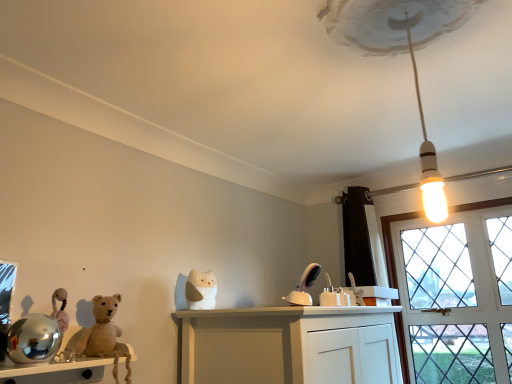
Question: Is point (419, 211) positioned closer to the camera than point (200, 281)?

Choices:
 (A) closer
 (B) farther

Answer: (B)

Question: Which is correct: clear glass window at right is inside white matte cat at center, or outside of it?

Choices:
 (A) inside
 (B) outside

Answer: (B)

Question: Estimate the real-world distances between objects in this image. Which object is closer to the white glossy bulb at upper center?

Choices:
 (A) clear glass window at right
 (B) white matte cat at center
 (C) fuzzy beige teddy bear at left
 (D) wooden shelf at lower left

Answer: (B)

Question: Based on their relative distances, which object is nearer to the clear glass window at right?

Choices:
 (A) wooden shelf at lower left
 (B) fuzzy beige teddy bear at left
 (C) white glossy bulb at upper center
 (D) white matte cat at center

Answer: (C)